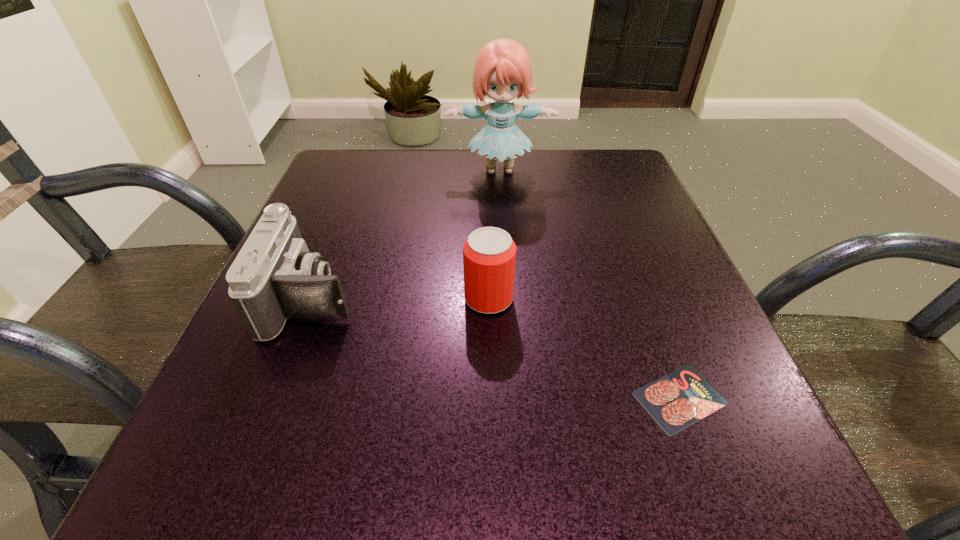
Identify the location of object located in the far edge section of the desktop. The height and width of the screenshot is (540, 960). (503, 71).

Find the location of a particular element. The image size is (960, 540). object that is at the near edge is located at coordinates (677, 400).

You are a GUI agent. You are given a task and a screenshot of the screen. Output one action in this format:
    pyautogui.click(x=<x>, y=<y>)
    Task: Click on the object situated at the left edge
    The width and height of the screenshot is (960, 540).
    Given the screenshot: What is the action you would take?
    pyautogui.click(x=274, y=277)

The width and height of the screenshot is (960, 540). In order to click on object that is at the right edge in this screenshot , I will do `click(677, 400)`.

At what (x,y) coordinates should I click in order to perform the action: click on object that is at the near right corner. Please return your answer as a coordinate pair (x, y). The width and height of the screenshot is (960, 540). Looking at the image, I should click on (677, 400).

In the image, there is a desktop. Where is `vacant space at the far edge`? vacant space at the far edge is located at coordinates (476, 184).

Find the location of a particular element. free region at the left edge of the desktop is located at coordinates (368, 215).

In the image, there is a desktop. At what (x,y) coordinates should I click in order to perform the action: click on vacant space at the right edge. Please return your answer as a coordinate pair (x, y). The height and width of the screenshot is (540, 960). Looking at the image, I should click on (627, 327).

The width and height of the screenshot is (960, 540). In the image, there is a desktop. Find the location of `free space at the far left corner`. free space at the far left corner is located at coordinates (376, 166).

In the image, there is a desktop. At what (x,y) coordinates should I click in order to perform the action: click on vacant area at the near left corner. Please return your answer as a coordinate pair (x, y). Looking at the image, I should click on (276, 441).